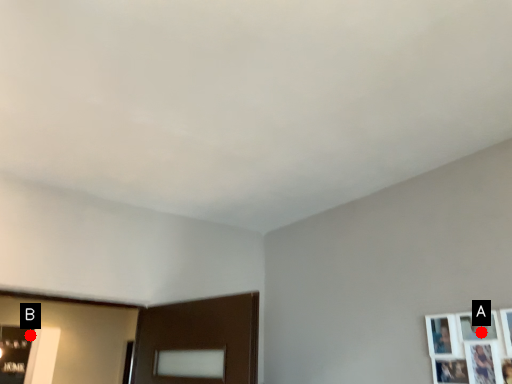
Question: Two points are circled on the image, labeled by A and B beside each circle. Which point is closer to the camera taking this photo?

Choices:
 (A) A is closer
 (B) B is closer

Answer: (A)